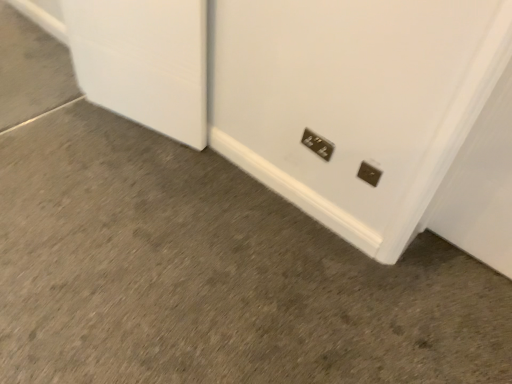
Describe the element at coordinates (369, 174) in the screenshot. Image resolution: width=512 pixels, height=384 pixels. I see `metallic silver power plug at lower right, the 2th power plugs and sockets in the back-to-front sequence` at that location.

The height and width of the screenshot is (384, 512). I want to click on metallic silver power plug at lower right, which is counted as the 2th power plugs and sockets, starting from the top, so (x=369, y=174).

How much space does metallic silver power plug at lower right, the 2th power plugs and sockets in the back-to-front sequence, occupy horizontally?

metallic silver power plug at lower right, the 2th power plugs and sockets in the back-to-front sequence, is 0.42 inches wide.

The width and height of the screenshot is (512, 384). I want to click on metallic silver power plugs and sockets at lower center, the 2th power plugs and sockets in the bottom-to-top sequence, so click(x=317, y=144).

What do you see at coordinates (317, 144) in the screenshot? I see `metallic silver power plugs and sockets at lower center, positioned as the first power plugs and sockets in top-to-bottom order` at bounding box center [317, 144].

Locate an element on the screen. The height and width of the screenshot is (384, 512). metallic silver power plug at lower right, positioned as the second power plugs and sockets in left-to-right order is located at coordinates tap(369, 174).

Considering the relative positions of metallic silver power plug at lower right, the first power plugs and sockets when ordered from front to back, and metallic silver power plugs and sockets at lower center, positioned as the first power plugs and sockets in top-to-bottom order, in the image provided, is metallic silver power plug at lower right, the first power plugs and sockets when ordered from front to back, to the left of metallic silver power plugs and sockets at lower center, positioned as the first power plugs and sockets in top-to-bottom order, from the viewer's perspective?

No.

Considering the positions of objects metallic silver power plug at lower right, the first power plugs and sockets when ordered from front to back, and metallic silver power plugs and sockets at lower center, which ranks as the second power plugs and sockets in right-to-left order, in the image provided, who is in front, metallic silver power plug at lower right, the first power plugs and sockets when ordered from front to back, or metallic silver power plugs and sockets at lower center, which ranks as the second power plugs and sockets in right-to-left order,?

metallic silver power plug at lower right, the first power plugs and sockets when ordered from front to back.

Is point (364, 163) positioned in front of point (321, 143)?

Yes, it is.

From the image's perspective, which is above, metallic silver power plug at lower right, which is counted as the 2th power plugs and sockets, starting from the top, or metallic silver power plugs and sockets at lower center, the 2th power plugs and sockets in the front-to-back sequence?

metallic silver power plugs and sockets at lower center, the 2th power plugs and sockets in the front-to-back sequence, appears higher in the image.

From a real-world perspective, which object stands above the other?

In real-world perspective, metallic silver power plug at lower right, the 1th power plugs and sockets viewed from the right, is above.

Which of these two, metallic silver power plug at lower right, arranged as the first power plugs and sockets when ordered from the bottom, or metallic silver power plugs and sockets at lower center, which is the first power plugs and sockets from left to right, is thinner?

metallic silver power plug at lower right, arranged as the first power plugs and sockets when ordered from the bottom, is thinner.

Is metallic silver power plug at lower right, the 1th power plugs and sockets viewed from the right, shorter than metallic silver power plugs and sockets at lower center, positioned as the first power plugs and sockets in top-to-bottom order?

Correct, metallic silver power plug at lower right, the 1th power plugs and sockets viewed from the right, is not as tall as metallic silver power plugs and sockets at lower center, positioned as the first power plugs and sockets in top-to-bottom order.

Can you confirm if metallic silver power plug at lower right, the 2th power plugs and sockets in the back-to-front sequence, is bigger than metallic silver power plugs and sockets at lower center, which ranks as the second power plugs and sockets in right-to-left order?

Actually, metallic silver power plug at lower right, the 2th power plugs and sockets in the back-to-front sequence, might be smaller than metallic silver power plugs and sockets at lower center, which ranks as the second power plugs and sockets in right-to-left order.

Is metallic silver power plug at lower right, positioned as the second power plugs and sockets in left-to-right order, located outside metallic silver power plugs and sockets at lower center, the 2th power plugs and sockets in the bottom-to-top sequence?

Yes, metallic silver power plug at lower right, positioned as the second power plugs and sockets in left-to-right order, is outside of metallic silver power plugs and sockets at lower center, the 2th power plugs and sockets in the bottom-to-top sequence.

Are metallic silver power plug at lower right, arranged as the first power plugs and sockets when ordered from the bottom, and metallic silver power plugs and sockets at lower center, the 2th power plugs and sockets in the bottom-to-top sequence, beside each other?

No.

Is metallic silver power plugs and sockets at lower center, the 2th power plugs and sockets in the front-to-back sequence, at the back of metallic silver power plug at lower right, arranged as the first power plugs and sockets when ordered from the bottom?

No, metallic silver power plug at lower right, arranged as the first power plugs and sockets when ordered from the bottom,'s orientation is not away from metallic silver power plugs and sockets at lower center, the 2th power plugs and sockets in the front-to-back sequence.

What's the angular difference between metallic silver power plug at lower right, the first power plugs and sockets when ordered from front to back, and metallic silver power plugs and sockets at lower center, positioned as the first power plugs and sockets in top-to-bottom order,'s facing directions?

1.73 degrees.

Could you measure the distance between metallic silver power plug at lower right, the first power plugs and sockets when ordered from front to back, and metallic silver power plugs and sockets at lower center, the 2th power plugs and sockets in the bottom-to-top sequence?

metallic silver power plug at lower right, the first power plugs and sockets when ordered from front to back, is 7.33 inches away from metallic silver power plugs and sockets at lower center, the 2th power plugs and sockets in the bottom-to-top sequence.

What are the coordinates of `power plugs and sockets below the metallic silver power plugs and sockets at lower center, which is the first power plugs and sockets from left to right (from the image's perspective)` in the screenshot? It's located at (369, 174).

Which is more to the right, metallic silver power plugs and sockets at lower center, which is the first power plugs and sockets from back to front, or metallic silver power plug at lower right, which is counted as the 2th power plugs and sockets, starting from the top?

Positioned to the right is metallic silver power plug at lower right, which is counted as the 2th power plugs and sockets, starting from the top.

Considering their positions, is metallic silver power plugs and sockets at lower center, the 2th power plugs and sockets in the bottom-to-top sequence, located in front of or behind metallic silver power plug at lower right, the 1th power plugs and sockets viewed from the right?

metallic silver power plugs and sockets at lower center, the 2th power plugs and sockets in the bottom-to-top sequence, is positioned farther from the viewer than metallic silver power plug at lower right, the 1th power plugs and sockets viewed from the right.

Does point (324, 159) come farther from viewer compared to point (374, 181)?

Yes, point (324, 159) is behind point (374, 181).

From the image's perspective, is metallic silver power plugs and sockets at lower center, the 2th power plugs and sockets in the front-to-back sequence, under metallic silver power plug at lower right, the 2th power plugs and sockets in the back-to-front sequence?

Actually, metallic silver power plugs and sockets at lower center, the 2th power plugs and sockets in the front-to-back sequence, appears above metallic silver power plug at lower right, the 2th power plugs and sockets in the back-to-front sequence, in the image.

From a real-world perspective, between metallic silver power plugs and sockets at lower center, the 2th power plugs and sockets in the bottom-to-top sequence, and metallic silver power plug at lower right, positioned as the second power plugs and sockets in left-to-right order, who is vertically higher?

In real-world perspective, metallic silver power plug at lower right, positioned as the second power plugs and sockets in left-to-right order, is above.

Which of these two, metallic silver power plugs and sockets at lower center, which ranks as the second power plugs and sockets in right-to-left order, or metallic silver power plug at lower right, the first power plugs and sockets when ordered from front to back, is wider?

metallic silver power plugs and sockets at lower center, which ranks as the second power plugs and sockets in right-to-left order, is wider.

From their relative heights in the image, would you say metallic silver power plugs and sockets at lower center, which is the first power plugs and sockets from left to right, is taller or shorter than metallic silver power plug at lower right, arranged as the first power plugs and sockets when ordered from the bottom?

In the image, metallic silver power plugs and sockets at lower center, which is the first power plugs and sockets from left to right, appears to be taller than metallic silver power plug at lower right, arranged as the first power plugs and sockets when ordered from the bottom.

Considering the relative sizes of metallic silver power plugs and sockets at lower center, which is the first power plugs and sockets from back to front, and metallic silver power plug at lower right, arranged as the first power plugs and sockets when ordered from the bottom, in the image provided, is metallic silver power plugs and sockets at lower center, which is the first power plugs and sockets from back to front, smaller than metallic silver power plug at lower right, arranged as the first power plugs and sockets when ordered from the bottom,?

No.

Would you say metallic silver power plugs and sockets at lower center, the 2th power plugs and sockets in the bottom-to-top sequence, is inside or outside metallic silver power plug at lower right, the 1th power plugs and sockets viewed from the right?

metallic silver power plugs and sockets at lower center, the 2th power plugs and sockets in the bottom-to-top sequence, is spatially situated outside metallic silver power plug at lower right, the 1th power plugs and sockets viewed from the right.

Does metallic silver power plugs and sockets at lower center, which is the first power plugs and sockets from left to right, touch metallic silver power plug at lower right, the first power plugs and sockets when ordered from front to back?

No, metallic silver power plugs and sockets at lower center, which is the first power plugs and sockets from left to right, is not in contact with metallic silver power plug at lower right, the first power plugs and sockets when ordered from front to back.

From the picture: Is metallic silver power plugs and sockets at lower center, positioned as the first power plugs and sockets in top-to-bottom order, turned away from metallic silver power plug at lower right, the 1th power plugs and sockets viewed from the right?

No, metallic silver power plugs and sockets at lower center, positioned as the first power plugs and sockets in top-to-bottom order, is not facing the opposite direction of metallic silver power plug at lower right, the 1th power plugs and sockets viewed from the right.

How many degrees apart are the facing directions of metallic silver power plugs and sockets at lower center, positioned as the first power plugs and sockets in top-to-bottom order, and metallic silver power plug at lower right, which is counted as the 2th power plugs and sockets, starting from the top?

There is a 1.73-degree angle between the facing directions of metallic silver power plugs and sockets at lower center, positioned as the first power plugs and sockets in top-to-bottom order, and metallic silver power plug at lower right, which is counted as the 2th power plugs and sockets, starting from the top.

From the picture: Could you measure the distance between metallic silver power plugs and sockets at lower center, which is the first power plugs and sockets from left to right, and metallic silver power plug at lower right, arranged as the first power plugs and sockets when ordered from the bottom?

metallic silver power plugs and sockets at lower center, which is the first power plugs and sockets from left to right, is 7.33 inches from metallic silver power plug at lower right, arranged as the first power plugs and sockets when ordered from the bottom.

In order to click on power plugs and sockets behind the metallic silver power plug at lower right, the 2th power plugs and sockets in the back-to-front sequence in this screenshot , I will do `click(317, 144)`.

Locate an element on the screen. The width and height of the screenshot is (512, 384). power plugs and sockets on the left of metallic silver power plug at lower right, the 1th power plugs and sockets viewed from the right is located at coordinates (317, 144).

At what (x,y) coordinates should I click in order to perform the action: click on power plugs and sockets behind the metallic silver power plug at lower right, the first power plugs and sockets when ordered from front to back. Please return your answer as a coordinate pair (x, y). This screenshot has height=384, width=512. Looking at the image, I should click on click(x=317, y=144).